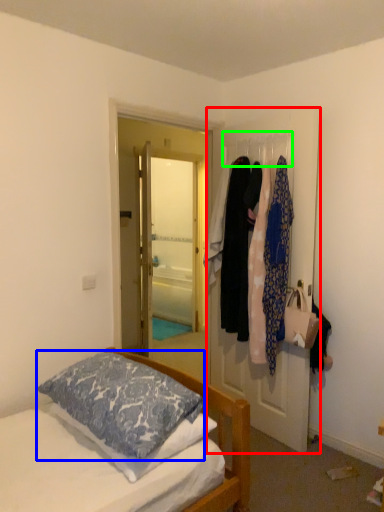
Question: Which object is the closest to the door (highlighted by a red box)? Choose among these: pillow (highlighted by a blue box) or clothesline (highlighted by a green box).

Choices:
 (A) pillow
 (B) clothesline

Answer: (B)